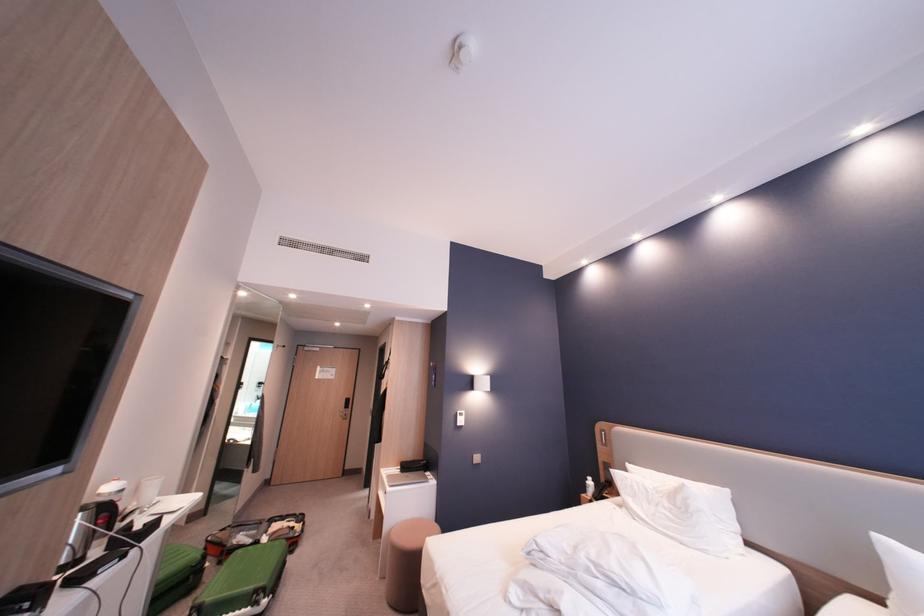
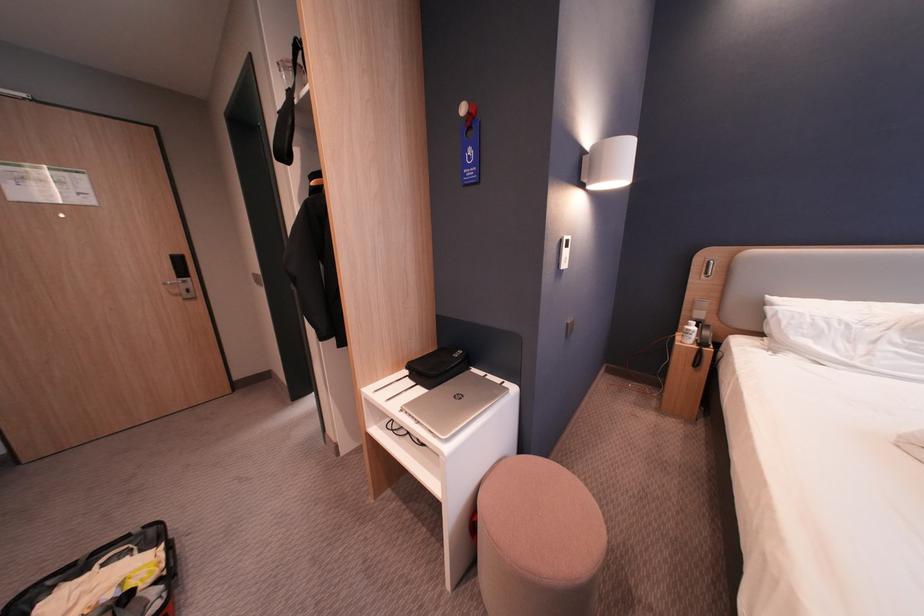
Find the pixel in the second image that matches the point at 432,464 in the first image.

(467, 357)